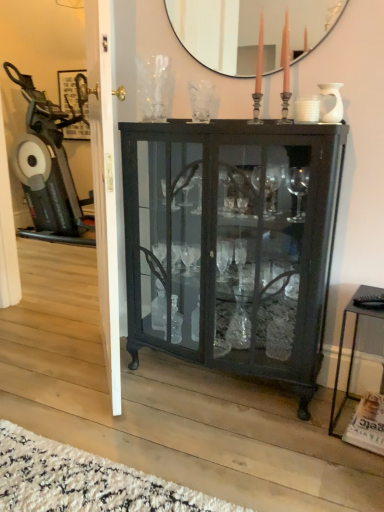
Question: Choose the correct answer: Is white glossy door at center inside black metal side table at lower right or outside it?

Choices:
 (A) inside
 (B) outside

Answer: (B)

Question: Considering the relative positions of white glossy door at center and black metal side table at lower right in the image provided, is white glossy door at center to the left or to the right of black metal side table at lower right?

Choices:
 (A) right
 (B) left

Answer: (B)

Question: Considering the real-world distances, which object is farthest from the matte black cabinet at center?

Choices:
 (A) white glossy door at center
 (B) black metal side table at lower right
 (C) white shag rug at lower left
 (D) matte black mirror at upper center

Answer: (C)

Question: Which of these objects is positioned closest to the white shag rug at lower left?

Choices:
 (A) matte black cabinet at center
 (B) black metal side table at lower right
 (C) white glossy door at center
 (D) matte black mirror at upper center

Answer: (C)